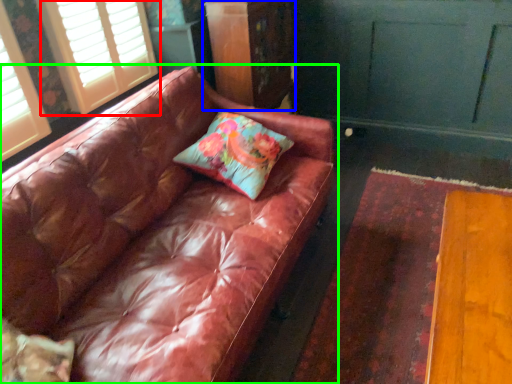
Question: Which object is the farthest from window (highlighted by a red box)? Choose among these: dresser (highlighted by a blue box) or studio couch (highlighted by a green box).

Choices:
 (A) dresser
 (B) studio couch

Answer: (B)